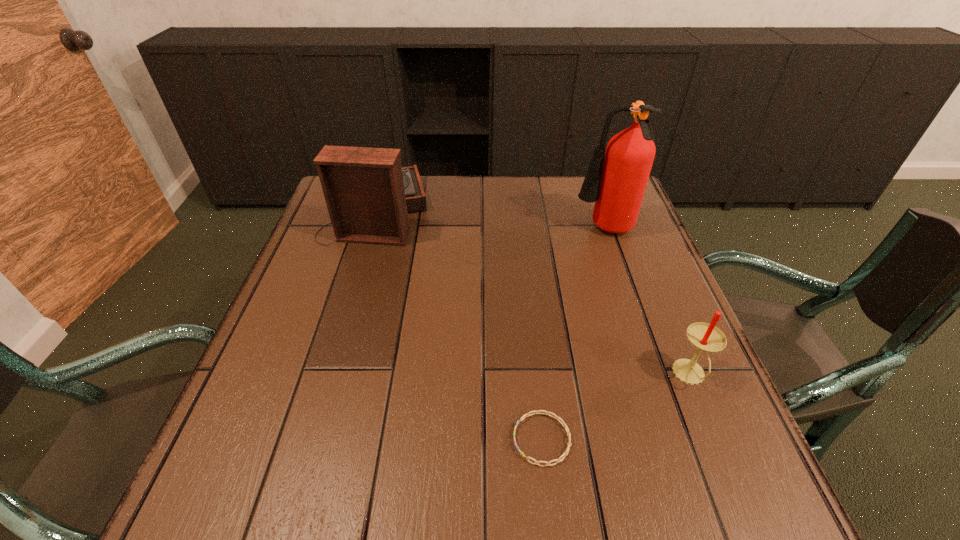
Identify which object is the closest to the second nearest object. Please provide its 2D coordinates. Your answer should be formatted as a tuple, i.e. [(x, y)], where the tuple contains the x and y coordinates of a point satisfying the conditions above.

[(524, 416)]

Identify the location of vacant space that satisfies the following two spatial constraints: 1. at the nozzle of the candle; 2. on the left side of the fire extinguisher. The width and height of the screenshot is (960, 540). (654, 375).

Image resolution: width=960 pixels, height=540 pixels. I want to click on free space that satisfies the following two spatial constraints: 1. at the nozzle of the fire extinguisher; 2. on the left side of the candle, so [x=654, y=375].

Where is `free space that satisfies the following two spatial constraints: 1. on the front side of the candle; 2. on the surface of the nearest object showing star-shaped elements`? The height and width of the screenshot is (540, 960). free space that satisfies the following two spatial constraints: 1. on the front side of the candle; 2. on the surface of the nearest object showing star-shaped elements is located at coordinates 716,439.

This screenshot has width=960, height=540. I want to click on vacant point that satisfies the following two spatial constraints: 1. on the back side of the candle; 2. at the nozzle of the fire extinguisher, so click(631, 231).